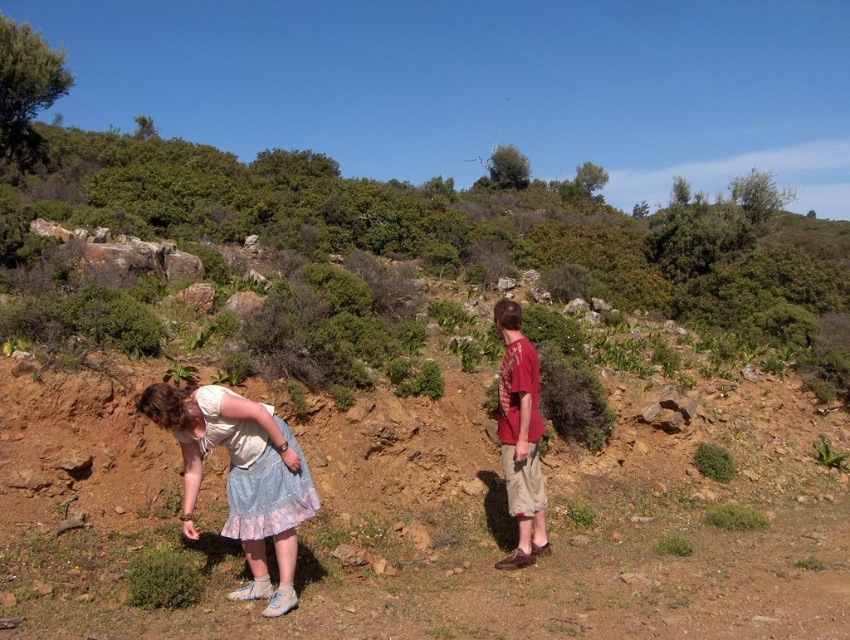
Is white cotton shirt at lower left smaller than matte red shirt at center?

Incorrect, white cotton shirt at lower left is not smaller in size than matte red shirt at center.

Between point (197, 424) and point (533, 358), which one is positioned behind?

Positioned behind is point (533, 358).

Where is `white cotton shirt at lower left`? This screenshot has height=640, width=850. white cotton shirt at lower left is located at coordinates (241, 477).

Which is above, light blue cotton skirt at lower left or white cotton shirt at lower left?

white cotton shirt at lower left

Between light blue cotton skirt at lower left and white cotton shirt at lower left, which one has more height?

With more height is light blue cotton skirt at lower left.

The width and height of the screenshot is (850, 640). I want to click on light blue cotton skirt at lower left, so click(241, 477).

Is light blue cotton skirt at lower left wider than matte red shirt at center?

Yes.

Between light blue cotton skirt at lower left and matte red shirt at center, which one has less height?

light blue cotton skirt at lower left

Measure the distance between light blue cotton skirt at lower left and camera.

light blue cotton skirt at lower left and camera are 4.98 meters apart from each other.

The image size is (850, 640). What are the coordinates of `light blue cotton skirt at lower left` in the screenshot? It's located at (241, 477).